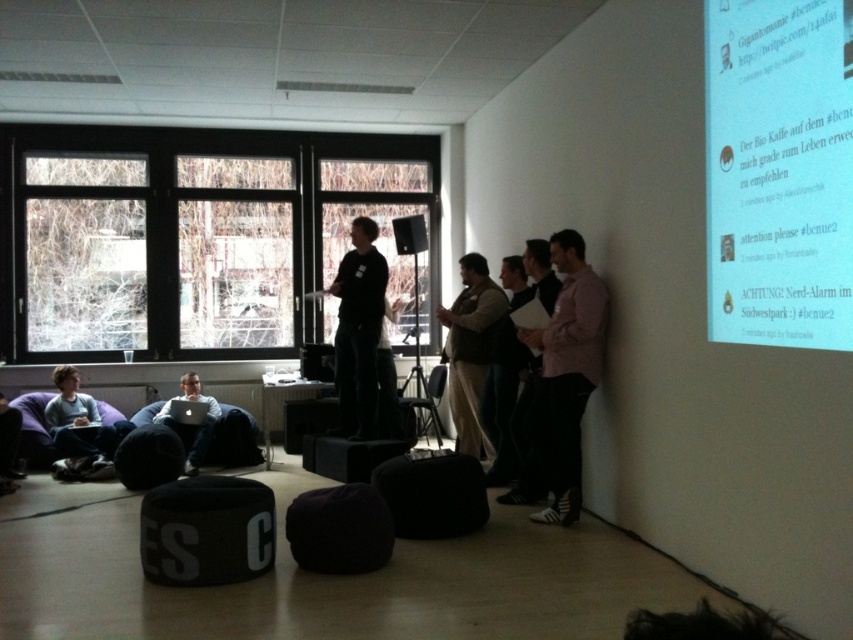
What do you see at coordinates (778, 172) in the screenshot? I see `white paper at upper right` at bounding box center [778, 172].

Is white paper at upper right to the right of black matte speaker at center from the viewer's perspective?

Yes, white paper at upper right is to the right of black matte speaker at center.

At what (x,y) coordinates should I click in order to perform the action: click on white paper at upper right. Please return your answer as a coordinate pair (x, y). Looking at the image, I should click on (778, 172).

Is the position of white paper at upper right less distant than that of light blue fabric bean bag at lower left?

Yes, white paper at upper right is closer to the viewer.

Who is lower down, white paper at upper right or light blue fabric bean bag at lower left?

light blue fabric bean bag at lower left

At what (x,y) coordinates should I click in order to perform the action: click on white paper at upper right. Please return your answer as a coordinate pair (x, y). This screenshot has width=853, height=640. Looking at the image, I should click on (778, 172).

From the picture: Is the position of white paper at upper right less distant than that of matte black laptop at lower left?

Yes, it is.

Based on the photo, which is above, white paper at upper right or matte black laptop at lower left?

Positioned higher is white paper at upper right.

Does point (770, 253) come in front of point (196, 449)?

Yes, point (770, 253) is in front of point (196, 449).

At what (x,y) coordinates should I click in order to perform the action: click on white paper at upper right. Please return your answer as a coordinate pair (x, y). Looking at the image, I should click on (778, 172).